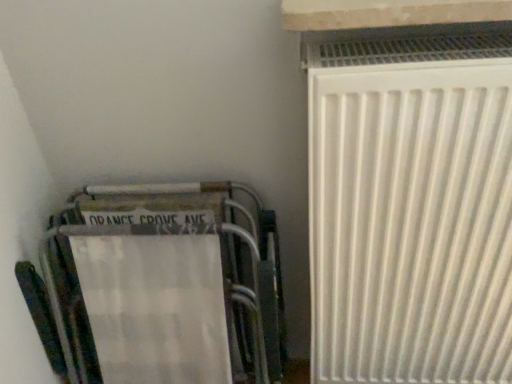
This screenshot has height=384, width=512. Describe the element at coordinates (388, 13) in the screenshot. I see `white stone window sill at upper right` at that location.

This screenshot has height=384, width=512. Describe the element at coordinates (155, 289) in the screenshot. I see `metallic silver folding chair at lower left` at that location.

Identify the location of white matte radiator at right. The width and height of the screenshot is (512, 384). (410, 208).

Between white matte radiator at right and metallic silver folding chair at lower left, which one has larger size?

Bigger between the two is white matte radiator at right.

From a real-world perspective, is white matte radiator at right beneath metallic silver folding chair at lower left?

No, from a real-world perspective, white matte radiator at right is not below metallic silver folding chair at lower left.

Does white matte radiator at right have a lesser height compared to metallic silver folding chair at lower left?

Incorrect, the height of white matte radiator at right does not fall short of that of metallic silver folding chair at lower left.

Where is `radiator above the metallic silver folding chair at lower left (from a real-world perspective)`? Image resolution: width=512 pixels, height=384 pixels. radiator above the metallic silver folding chair at lower left (from a real-world perspective) is located at coordinates (410, 208).

Which object is further away from the camera, metallic silver folding chair at lower left or white stone window sill at upper right?

metallic silver folding chair at lower left is further from the camera.

Is metallic silver folding chair at lower left shorter than white stone window sill at upper right?

No, metallic silver folding chair at lower left is not shorter than white stone window sill at upper right.

Based on the photo, relative to white matte radiator at right, is white stone window sill at upper right in front or behind?

white stone window sill at upper right is positioned closer to the viewer than white matte radiator at right.

Considering the sizes of objects white stone window sill at upper right and white matte radiator at right in the image provided, who is taller, white stone window sill at upper right or white matte radiator at right?

white matte radiator at right.

From the image's perspective, who appears lower, white stone window sill at upper right or white matte radiator at right?

From the image's view, white matte radiator at right is below.

Is white stone window sill at upper right smaller than metallic silver folding chair at lower left?

Yes.

Are white stone window sill at upper right and metallic silver folding chair at lower left making contact?

No, white stone window sill at upper right is not in contact with metallic silver folding chair at lower left.

Is white stone window sill at upper right positioned beyond the bounds of metallic silver folding chair at lower left?

white stone window sill at upper right lies outside metallic silver folding chair at lower left's area.

Would you say metallic silver folding chair at lower left is to the left or to the right of white matte radiator at right in the picture?

metallic silver folding chair at lower left is positioned on white matte radiator at right's left side.

Is metallic silver folding chair at lower left far away from white matte radiator at right?

They are positioned close to each other.

Considering the sizes of objects metallic silver folding chair at lower left and white matte radiator at right in the image provided, who is thinner, metallic silver folding chair at lower left or white matte radiator at right?

metallic silver folding chair at lower left is thinner.

Is point (357, 241) more distant than point (468, 10)?

Yes, point (357, 241) is behind point (468, 10).

Is white matte radiator at right facing towards white stone window sill at upper right?

→ No, white matte radiator at right is not facing towards white stone window sill at upper right.

From the image's perspective, is white matte radiator at right located above or below white stone window sill at upper right?

Based on their image positions, white matte radiator at right is located beneath white stone window sill at upper right.

The height and width of the screenshot is (384, 512). What are the coordinates of `radiator directly beneath the white stone window sill at upper right (from a real-world perspective)` in the screenshot? It's located at (410, 208).

Where is `furniture below the white matte radiator at right (from a real-world perspective)`? The image size is (512, 384). furniture below the white matte radiator at right (from a real-world perspective) is located at coordinates (155, 289).

At what (x,y) coordinates should I click in order to perform the action: click on window sill that is above the metallic silver folding chair at lower left (from the image's perspective). Please return your answer as a coordinate pair (x, y). The width and height of the screenshot is (512, 384). Looking at the image, I should click on (388, 13).

Estimate the real-world distances between objects in this image. Which object is closer to white stone window sill at upper right, metallic silver folding chair at lower left or white matte radiator at right?

Among the two, white matte radiator at right is located nearer to white stone window sill at upper right.

Considering their positions, is metallic silver folding chair at lower left positioned closer to white matte radiator at right than white stone window sill at upper right?

white stone window sill at upper right is closer to white matte radiator at right.

Looking at the image, which one is located further to metallic silver folding chair at lower left, white matte radiator at right or white stone window sill at upper right?

Among the two, white stone window sill at upper right is located further to metallic silver folding chair at lower left.

Which object lies nearer to the anchor point metallic silver folding chair at lower left, white stone window sill at upper right or white matte radiator at right?

white matte radiator at right is positioned closer to the anchor metallic silver folding chair at lower left.

Estimate the real-world distances between objects in this image. Which object is closer to white stone window sill at upper right, white matte radiator at right or metallic silver folding chair at lower left?

white matte radiator at right.

Looking at the image, which one is located closer to white matte radiator at right, white stone window sill at upper right or metallic silver folding chair at lower left?

Among the two, white stone window sill at upper right is located nearer to white matte radiator at right.

Where is `window sill between metallic silver folding chair at lower left and white matte radiator at right from left to right`? The height and width of the screenshot is (384, 512). window sill between metallic silver folding chair at lower left and white matte radiator at right from left to right is located at coordinates (388, 13).